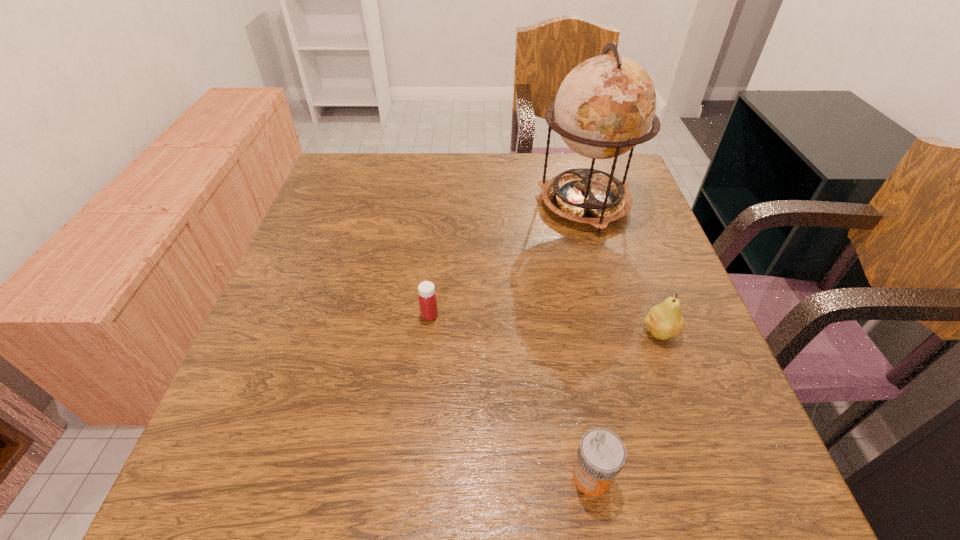
The height and width of the screenshot is (540, 960). I want to click on globe, so click(605, 106).

The image size is (960, 540). What are the coordinates of `the farthest object` in the screenshot? It's located at (605, 106).

The image size is (960, 540). Identify the location of pear. (665, 320).

Locate an element on the screen. This screenshot has width=960, height=540. the nearest object is located at coordinates (601, 455).

Locate an element on the screen. This screenshot has height=540, width=960. the right medicine is located at coordinates (601, 455).

Locate an element on the screen. The height and width of the screenshot is (540, 960). the left medicine is located at coordinates (427, 298).

Where is `the farther medicine`? The height and width of the screenshot is (540, 960). the farther medicine is located at coordinates (427, 298).

Locate an element on the screen. Image resolution: width=960 pixels, height=540 pixels. free space located at the center of the globe is located at coordinates (600, 258).

At what (x,y) coordinates should I click in order to perform the action: click on vacant space located on the front of the pear. Please return your answer as a coordinate pair (x, y). Image resolution: width=960 pixels, height=540 pixels. Looking at the image, I should click on coord(680,389).

Locate an element on the screen. The height and width of the screenshot is (540, 960). vacant space located 0.140m on the label side of the right medicine is located at coordinates (477, 477).